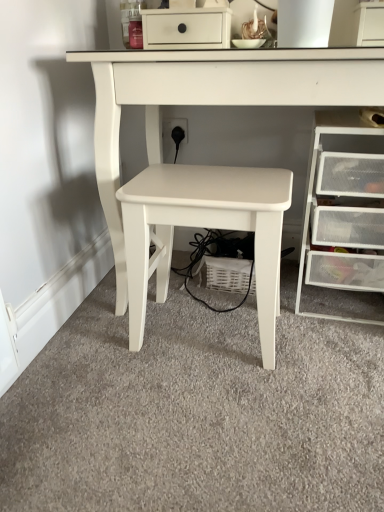
Question: In terms of width, does clear plastic drawers at right look wider or thinner when compared to white matte table at center, the 2th table positioned from the left?

Choices:
 (A) thin
 (B) wide

Answer: (A)

Question: Considering the positions of point (359, 196) and point (173, 88), is point (359, 196) closer or farther from the camera than point (173, 88)?

Choices:
 (A) farther
 (B) closer

Answer: (A)

Question: Estimate the real-world distances between objects in this image. Which object is farther from the clear plastic drawers at right?

Choices:
 (A) white matte table at center, arranged as the 1th table when viewed from the left
 (B) white matte table at center, the 1th table when ordered from right to left

Answer: (B)

Question: Considering the real-world distances, which object is closest to the white matte table at center, the 1th table when ordered from right to left?

Choices:
 (A) clear plastic drawers at right
 (B) white matte table at center, positioned as the second table in right-to-left order

Answer: (B)